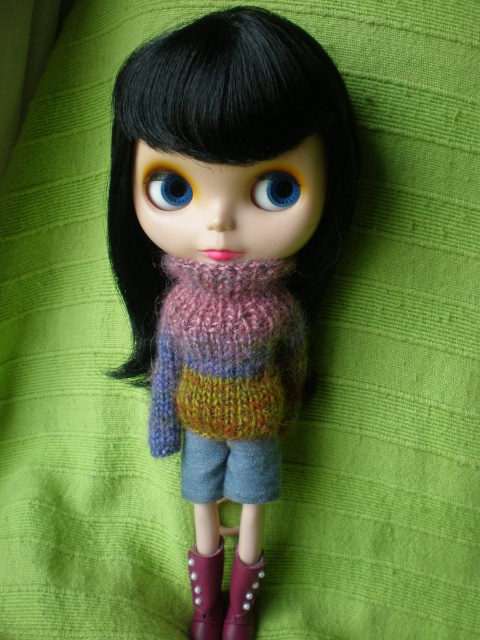
Question: Which of these objects is positioned farthest from the blue glossy eye at upper center?

Choices:
 (A) shiny purple boot at lower center
 (B) purple suede boot at lower center

Answer: (A)

Question: Which object is farther from the camera taking this photo?

Choices:
 (A) multicolored knitted sweater at center
 (B) blue matte eye at center
 (C) shiny purple boot at lower center
 (D) purple suede boot at lower center

Answer: (D)

Question: Which object appears farthest from the camera in this image?

Choices:
 (A) purple suede boot at lower center
 (B) knitted wool sweater at center

Answer: (A)

Question: Is multicolored knitted sweater at center closer to camera compared to knitted wool sweater at center?

Choices:
 (A) yes
 (B) no

Answer: (A)

Question: Is knitted wool sweater at center above shiny purple boot at lower center?

Choices:
 (A) no
 (B) yes

Answer: (B)

Question: Is multicolored knitted sweater at center above purple suede boot at lower center?

Choices:
 (A) no
 (B) yes

Answer: (B)